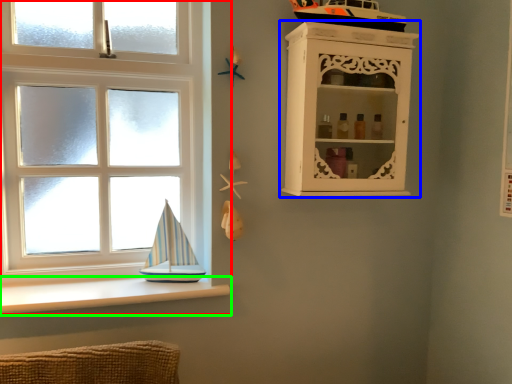
Question: Which is nearer to the window (highlighted by a red box)? shelf (highlighted by a blue box) or ledge (highlighted by a green box).

Choices:
 (A) shelf
 (B) ledge

Answer: (B)